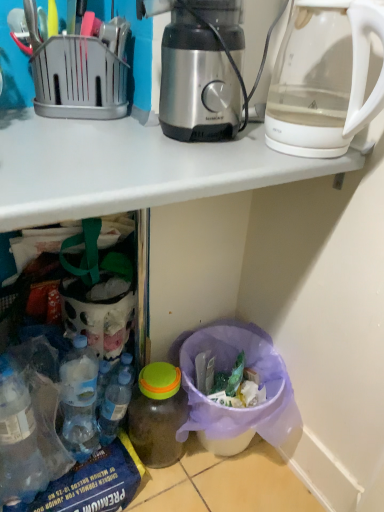
Find the location of a particular element. The width and height of the screenshot is (384, 512). vacant space underneath transparent glass kettle at upper right (from a real-world perspective) is located at coordinates (311, 155).